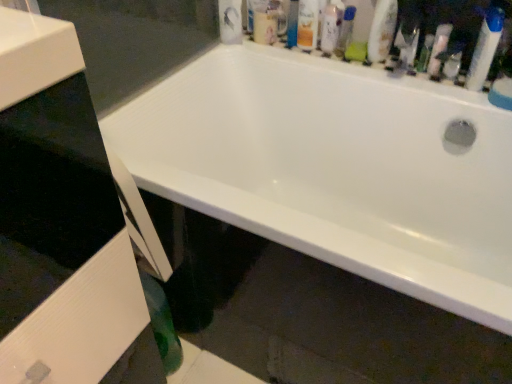
Question: From a real-world perspective, is translucent plastic mouthwash at upper center, the 2th mouthwash from the left, positioned above or below white glossy lotion at upper center, which ranks as the third toiletry in right-to-left order?

Choices:
 (A) above
 (B) below

Answer: (B)

Question: Is translucent plastic mouthwash at upper center, the 2th mouthwash from the left, inside the boundaries of white glossy lotion at upper center, marked as the 2th toiletry in a left-to-right arrangement, or outside?

Choices:
 (A) inside
 (B) outside

Answer: (B)

Question: Which object is positioned closest to the translucent plastic spray bottle at upper right, which is counted as the 1th cleaning product, starting from the right?

Choices:
 (A) white glossy bathtub at upper center
 (B) green plastic tube at upper right, the third toiletry in the left-to-right sequence
 (C) white plastic mouthwash at upper center, which appears as the first mouthwash when viewed from the left
 (D) white glossy bottle at upper right, positioned as the second cleaning product in right-to-left order
 (E) green plastic mouthwash at upper center, which is counted as the third mouthwash, starting from the left

Answer: (B)

Question: Estimate the real-world distances between objects in this image. Which object is farther from the white glossy bottle at upper right, the 1th cleaning product from the left?

Choices:
 (A) translucent plastic mouthwash at upper center, the second mouthwash viewed from the right
 (B) matte orange can at upper center, which ranks as the first toiletry in left-to-right order
 (C) white glossy bathtub at upper center
 (D) white glossy lotion at upper center, marked as the 2th toiletry in a left-to-right arrangement
 (E) translucent plastic spray bottle at upper right, which appears as the 2th cleaning product when viewed from the left

Answer: (C)